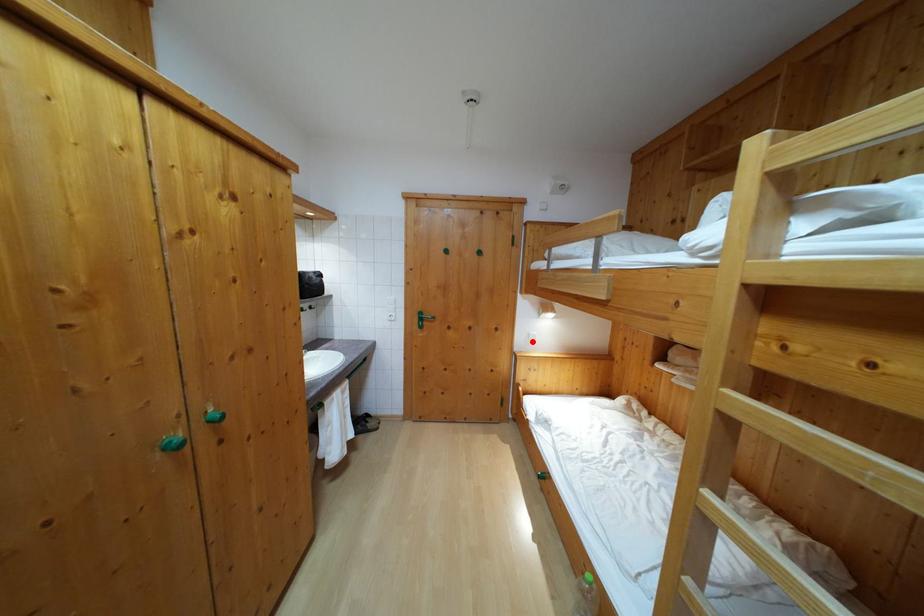
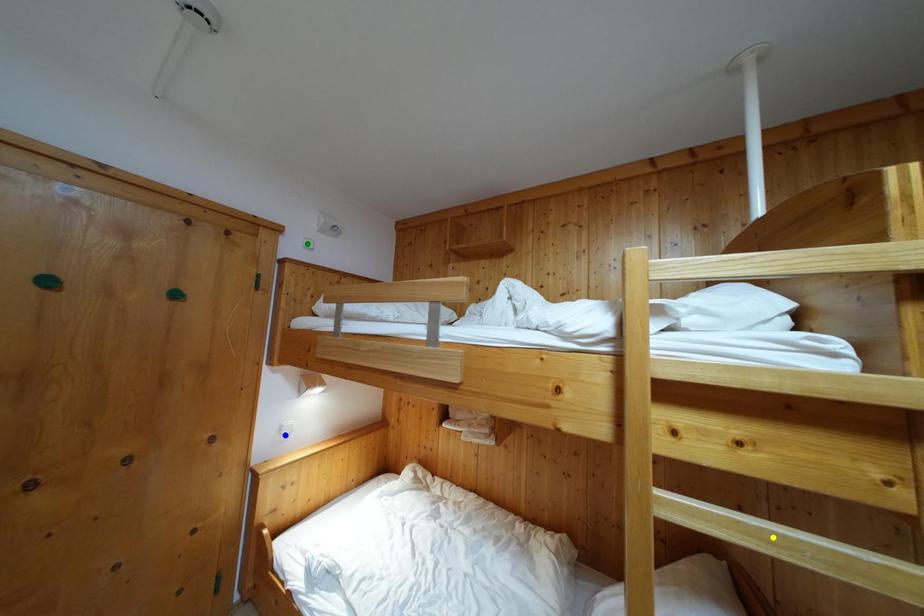
Question: I am providing you with two images of the same scene from different viewpoints. A red point is marked on the first image. You are given multiple points on the second image. Which mark in image 2 goes with the point in image 1?

Choices:
 (A) yellow point
 (B) blue point
 (C) green point

Answer: (B)